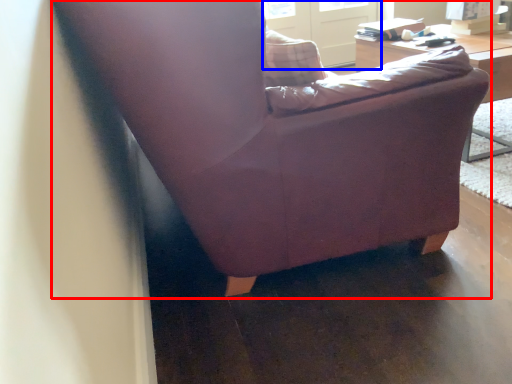
Question: Which object is further to the camera taking this photo, chair (highlighted by a red box) or screen door (highlighted by a blue box)?

Choices:
 (A) chair
 (B) screen door

Answer: (B)